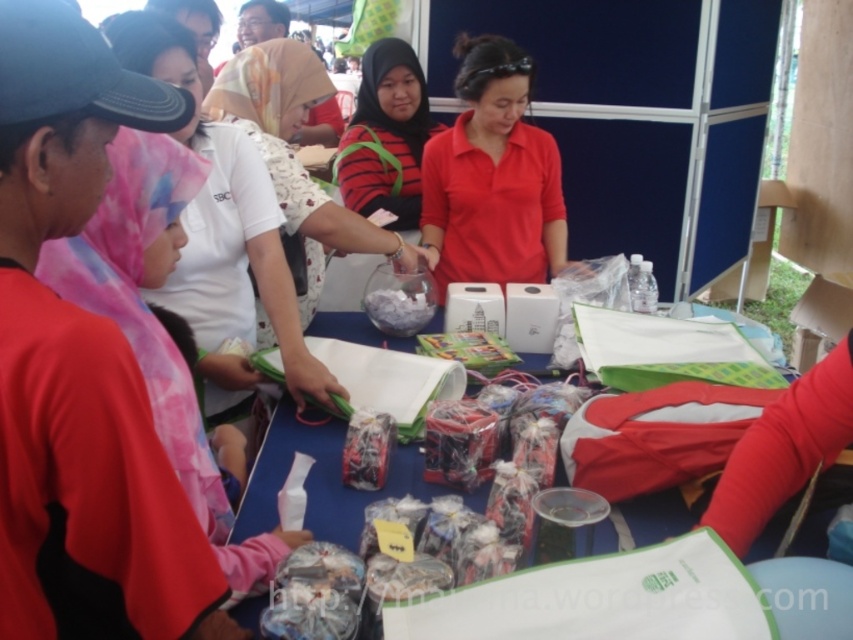
Who is more forward, (210, 132) or (383, 433)?

Point (383, 433) is more forward.

This screenshot has width=853, height=640. I want to click on pink fabric headscarf at left, so click(223, 218).

Is point (183, 38) positioned before point (386, 445)?

No.

At what (x,y) coordinates should I click in order to perform the action: click on pink fabric headscarf at left. Please return your answer as a coordinate pair (x, y). Looking at the image, I should click on (223, 218).

Is point (234, 132) closer to viewer compared to point (496, 339)?

Yes, point (234, 132) is in front of point (496, 339).

What do you see at coordinates (223, 218) in the screenshot?
I see `pink fabric headscarf at left` at bounding box center [223, 218].

You are a GUI agent. You are given a task and a screenshot of the screen. Output one action in this format:
    pyautogui.click(x=<x>, y=<y>)
    Task: Click on the pink fabric headscarf at left
    
    Given the screenshot: What is the action you would take?
    pyautogui.click(x=223, y=218)

Is blue fabric table at center smaller than matte plastic candy at center?

No, blue fabric table at center is not smaller than matte plastic candy at center.

Identify the location of blue fabric table at center. This screenshot has height=640, width=853. (321, 477).